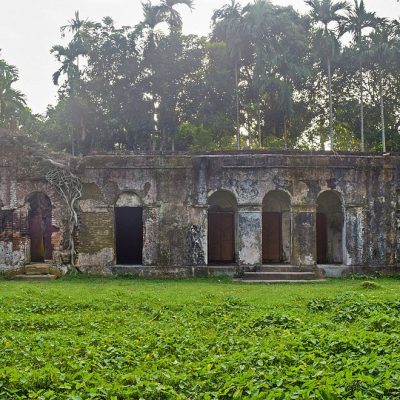
Find the location of a particular element. The height and width of the screenshot is (400, 400). far right doorway is located at coordinates (333, 211).